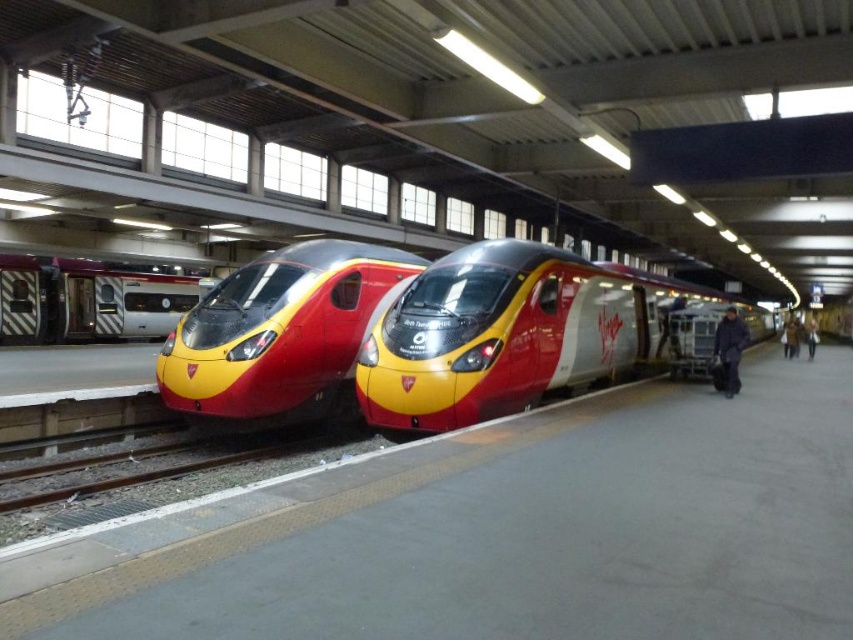
Which is more to the left, matte red/yellow train at center or silver metallic train at left?

silver metallic train at left

Is matte red/yellow train at center closer to camera compared to silver metallic train at left?

Yes, matte red/yellow train at center is closer to the viewer.

Is point (194, 381) closer to viewer compared to point (15, 326)?

Yes, it is in front of point (15, 326).

At what (x,y) coordinates should I click in order to perform the action: click on matte red/yellow train at center. Please return your answer as a coordinate pair (x, y). This screenshot has height=640, width=853. Looking at the image, I should click on (277, 328).

Is red/yellow glossy train at center positioned in front of silver metallic train at left?

Yes, red/yellow glossy train at center is in front of silver metallic train at left.

Between red/yellow glossy train at center and silver metallic train at left, which one is positioned lower?

red/yellow glossy train at center

Locate an element on the screen. Image resolution: width=853 pixels, height=640 pixels. red/yellow glossy train at center is located at coordinates 511,332.

This screenshot has height=640, width=853. I want to click on red/yellow glossy train at center, so 511,332.

Does red/yellow glossy train at center have a greater height compared to matte red/yellow train at center?

Indeed, red/yellow glossy train at center has a greater height compared to matte red/yellow train at center.

Who is shorter, red/yellow glossy train at center or matte red/yellow train at center?

Standing shorter between the two is matte red/yellow train at center.

Where is `red/yellow glossy train at center`? The height and width of the screenshot is (640, 853). red/yellow glossy train at center is located at coordinates click(511, 332).